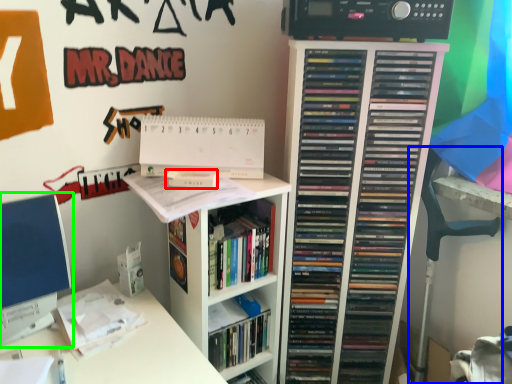
Question: Which object is the closest to the paperback book (highlighted by a red box)? Choose among these: swivel chair (highlighted by a blue box) or computer monitor (highlighted by a green box).

Choices:
 (A) swivel chair
 (B) computer monitor

Answer: (B)